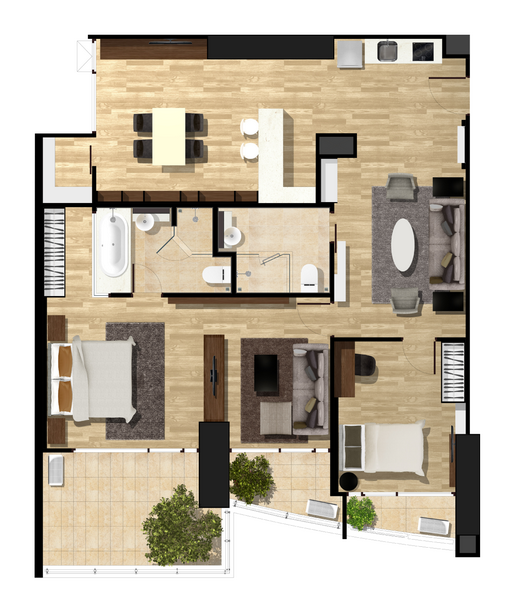
Locate an element on the screen. Image resolution: width=515 pixels, height=596 pixels. floor plan is located at coordinates (401, 116).